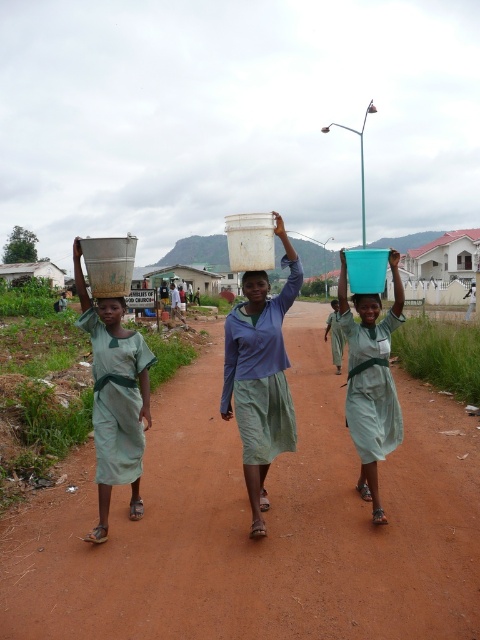
Between matte plastic head at upper center and matte plastic bucket at center, which one appears on the right side from the viewer's perspective?

Positioned to the right is matte plastic bucket at center.

Who is taller, matte plastic head at upper center or matte plastic bucket at center?

Standing taller between the two is matte plastic head at upper center.

Does point (118, 332) lie in front of point (367, 310)?

That is True.

Locate an element on the screen. matte plastic head at upper center is located at coordinates (111, 314).

Between brown dirt track at center and blue matte bucket at center, which one is positioned lower?

brown dirt track at center is lower down.

Looking at this image, is brown dirt track at center positioned at the back of blue matte bucket at center?

No, it is not.

Who is more distant from viewer, (120, 560) or (370, 304)?

The point (370, 304) is more distant.

Where is `brown dirt track at center`? The image size is (480, 640). brown dirt track at center is located at coordinates tap(266, 525).

Does point (312, 513) lie in front of point (276, 324)?

That is False.

Can you confirm if brown dirt track at center is thinner than matte white bucket at center?

In fact, brown dirt track at center might be wider than matte white bucket at center.

At what (x,y) coordinates should I click in order to perform the action: click on brown dirt track at center. Please return your answer as a coordinate pair (x, y). The width and height of the screenshot is (480, 640). Looking at the image, I should click on (266, 525).